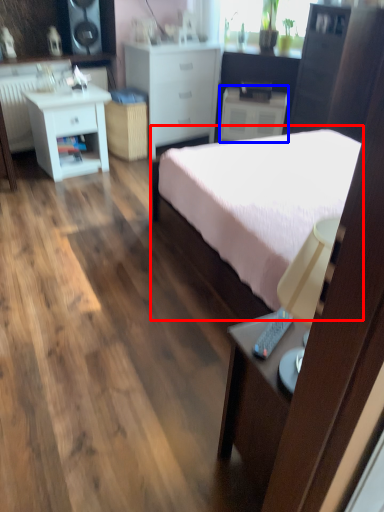
Question: Among these objects, which one is nearest to the camera, bed (highlighted by a red box) or nightstand (highlighted by a blue box)?

Choices:
 (A) bed
 (B) nightstand

Answer: (A)